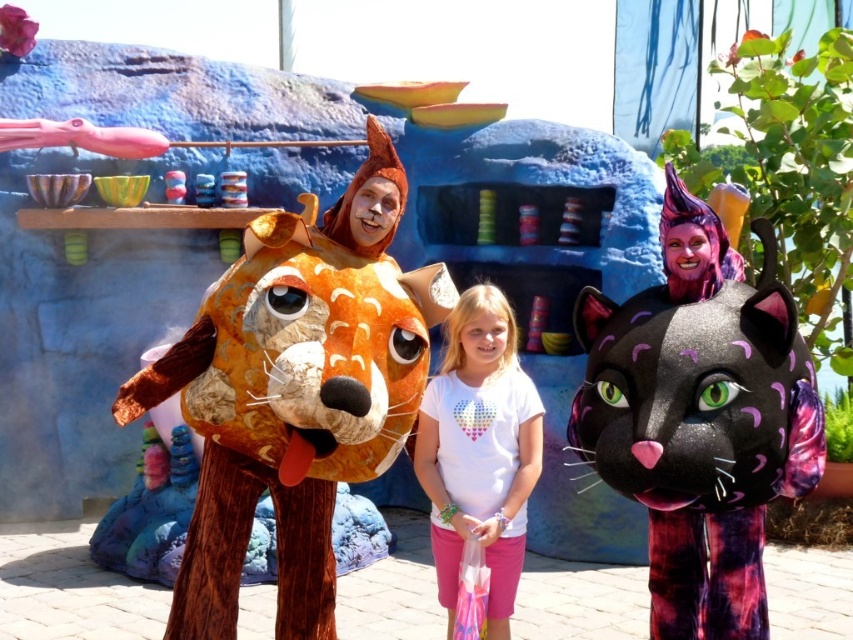
Looking at this image, you are holding a camera and want to take a photo of the wooden textured fox head at center. If you are standing 2.88 meters away from it, is the distance within the camera lens focus range of 3 meters?

The wooden textured fox head at center and camera are 2.88 meters apart, so the distance is within the camera lens focus range of 3 meters. You can take the photo.

In the scene shown: You are a photographer setting up a tripod to capture the scene. The wooden textured fox head at center and the black furry cat at right are both in your frame. Based on their sizes, which object should you focus on first if you want to ensure both are in focus?

The wooden textured fox head at center might be wider than the black furry cat at right, so focusing on the wider object first would help ensure both are in focus.